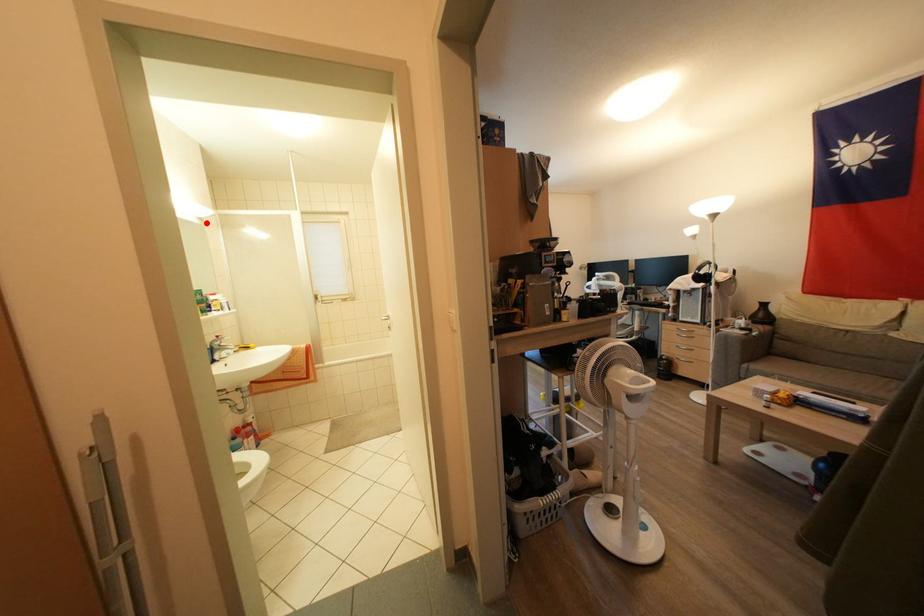
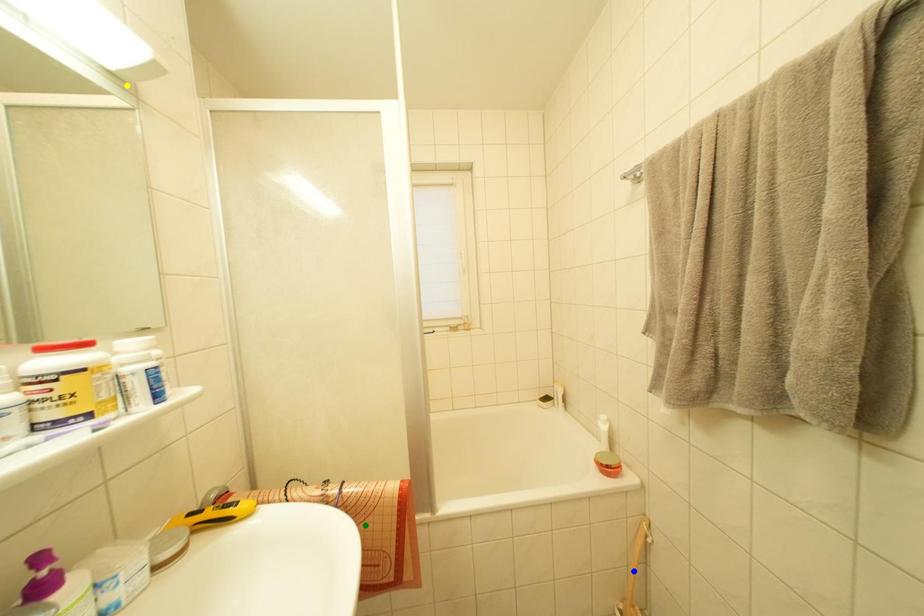
Question: I am providing you with two images of the same scene from different viewpoints. A red point is marked on the first image. You are given multiple points on the second image. Which spot in image 2 lines up with the point in image 1?

Choices:
 (A) green point
 (B) blue point
 (C) yellow point

Answer: (C)